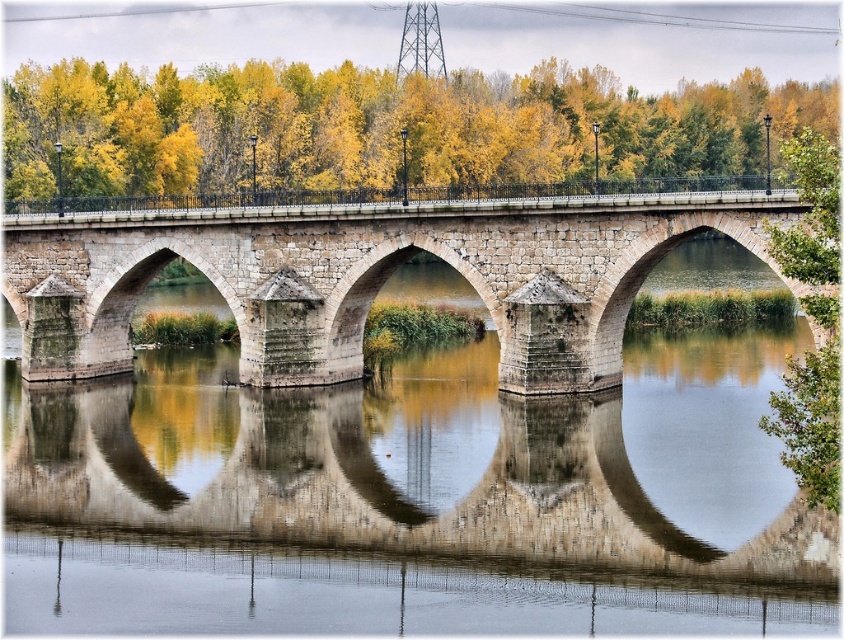
You are standing on the stone bridge and looking down. You see the smooth stone water at center and the green leafy tree at right. Which object is closer to you?

The smooth stone water at center is closer to you because it is located below the green leafy tree at right, meaning it is positioned between you and the tree.

You are standing on the stone bridge and want to find the smooth stone water at center. Based on the coordinates provided, in which direction should you look to locate it?

The smooth stone water at center is located at coordinates point (437, 461), so you should look towards the lower right direction from your position on the bridge.

You are standing on the stone bridge at center and looking towards the smooth stone water at center. Which object is closer to you?

The smooth stone water at center is closer to you because it is in front of the stone bridge at center.